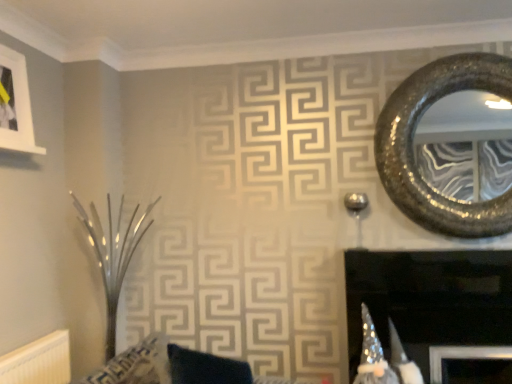
Question: Should I look upward or downward to see black glossy fireplace at center?

Choices:
 (A) up
 (B) down

Answer: (B)

Question: Considering the relative sizes of black glossy fireplace at center and sparkly metallic mirror at upper right in the image provided, is black glossy fireplace at center smaller than sparkly metallic mirror at upper right?

Choices:
 (A) yes
 (B) no

Answer: (B)

Question: Does black glossy fireplace at center have a greater height compared to sparkly metallic mirror at upper right?

Choices:
 (A) yes
 (B) no

Answer: (B)

Question: Considering the relative sizes of black glossy fireplace at center and sparkly metallic mirror at upper right in the image provided, is black glossy fireplace at center wider than sparkly metallic mirror at upper right?

Choices:
 (A) yes
 (B) no

Answer: (A)

Question: Considering the relative positions of black glossy fireplace at center and sparkly metallic mirror at upper right in the image provided, is black glossy fireplace at center to the right of sparkly metallic mirror at upper right from the viewer's perspective?

Choices:
 (A) yes
 (B) no

Answer: (B)

Question: From the image's perspective, is black glossy fireplace at center under sparkly metallic mirror at upper right?

Choices:
 (A) yes
 (B) no

Answer: (A)

Question: Is black glossy fireplace at center with sparkly metallic mirror at upper right?

Choices:
 (A) yes
 (B) no

Answer: (B)

Question: Is sparkly metallic mirror at upper right positioned behind velvet dark blue cushion at center?

Choices:
 (A) yes
 (B) no

Answer: (A)

Question: From the image's perspective, would you say sparkly metallic mirror at upper right is positioned over velvet dark blue cushion at center?

Choices:
 (A) no
 (B) yes

Answer: (B)

Question: Does sparkly metallic mirror at upper right have a smaller size compared to velvet dark blue cushion at center?

Choices:
 (A) no
 (B) yes

Answer: (B)

Question: Can you confirm if sparkly metallic mirror at upper right is wider than velvet dark blue cushion at center?

Choices:
 (A) yes
 (B) no

Answer: (B)

Question: From a real-world perspective, is sparkly metallic mirror at upper right located higher than velvet dark blue cushion at center?

Choices:
 (A) yes
 (B) no

Answer: (A)

Question: Considering the relative sizes of sparkly metallic mirror at upper right and velvet dark blue cushion at center in the image provided, is sparkly metallic mirror at upper right taller than velvet dark blue cushion at center?

Choices:
 (A) no
 (B) yes

Answer: (B)

Question: Are white textured radiator at lower left and black glossy fireplace at center far apart?

Choices:
 (A) yes
 (B) no

Answer: (A)